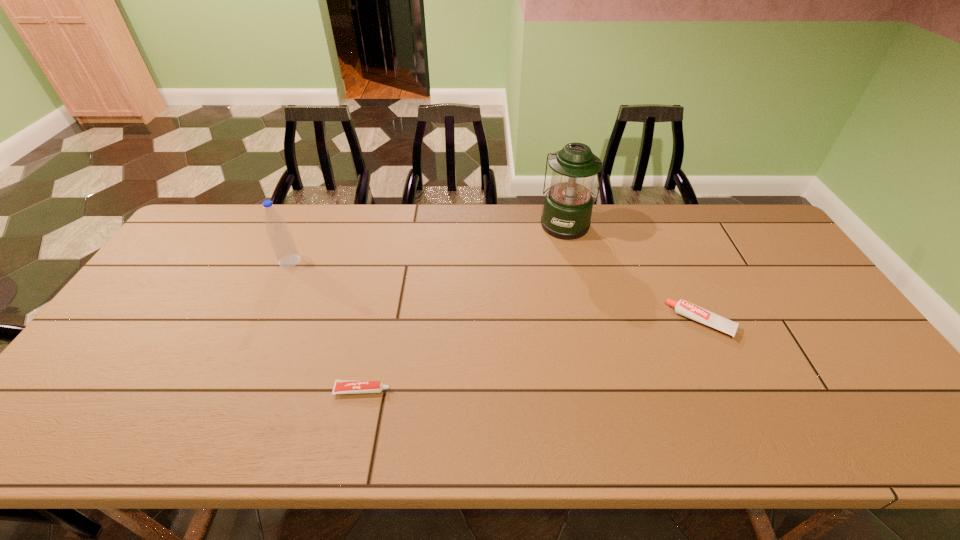
Image resolution: width=960 pixels, height=540 pixels. Identify the location of empty space that is in between the nearest object and the third shortest object. (326, 326).

Locate an element on the screen. The height and width of the screenshot is (540, 960). empty location between the nearest object and the farthest object is located at coordinates (464, 307).

This screenshot has width=960, height=540. What are the coordinates of `free space between the shortest object and the second nearest object` in the screenshot? It's located at (532, 356).

Find the location of a particular element. The width and height of the screenshot is (960, 540). free point between the water bottle and the rightmost object is located at coordinates (495, 292).

Image resolution: width=960 pixels, height=540 pixels. I want to click on blank region between the third nearest object and the farthest object, so click(428, 242).

Identify the location of vacant point located between the lantern and the right toothpaste. The image size is (960, 540). (634, 273).

The image size is (960, 540). Find the location of `vacant area that lies between the lantern and the rightmost object`. vacant area that lies between the lantern and the rightmost object is located at coordinates (634, 273).

At what (x,y) coordinates should I click in order to perform the action: click on free space between the third tallest object and the farthest object. Please return your answer as a coordinate pair (x, y). The height and width of the screenshot is (540, 960). Looking at the image, I should click on (634, 273).

This screenshot has width=960, height=540. What are the coordinates of `free space between the farthest object and the left toothpaste` in the screenshot? It's located at (464, 307).

In order to click on vacant space in between the second tallest object and the farthest object in this screenshot , I will do `click(428, 242)`.